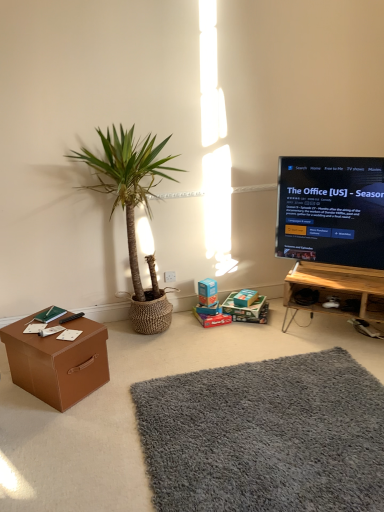
Question: Considering the relative sizes of black plastic remote control at lower left and cardboard box at center, the first cardboard box positioned from the left, in the image provided, is black plastic remote control at lower left thinner than cardboard box at center, the first cardboard box positioned from the left,?

Choices:
 (A) no
 (B) yes

Answer: (B)

Question: From the image's perspective, does black plastic remote control at lower left appear lower than cardboard box at center, acting as the second cardboard box starting from the right?

Choices:
 (A) no
 (B) yes

Answer: (A)

Question: Can you confirm if black plastic remote control at lower left is smaller than cardboard box at center, acting as the second cardboard box starting from the right?

Choices:
 (A) no
 (B) yes

Answer: (B)

Question: Can you confirm if black plastic remote control at lower left is taller than cardboard box at center, acting as the second cardboard box starting from the right?

Choices:
 (A) yes
 (B) no

Answer: (B)

Question: Considering the relative sizes of black plastic remote control at lower left and cardboard box at center, acting as the second cardboard box starting from the right, in the image provided, is black plastic remote control at lower left wider than cardboard box at center, acting as the second cardboard box starting from the right,?

Choices:
 (A) no
 (B) yes

Answer: (A)

Question: Is black plastic remote control at lower left oriented away from cardboard box at center, the first cardboard box positioned from the left?

Choices:
 (A) no
 (B) yes

Answer: (A)

Question: Does cardboard box at center, acting as the second cardboard box starting from the right, lie behind black glossy tv at right?

Choices:
 (A) yes
 (B) no

Answer: (A)

Question: Can you confirm if cardboard box at center, the first cardboard box positioned from the left, is thinner than black glossy tv at right?

Choices:
 (A) yes
 (B) no

Answer: (B)

Question: Is black glossy tv at right located within cardboard box at center, acting as the second cardboard box starting from the right?

Choices:
 (A) no
 (B) yes

Answer: (A)

Question: Would you say cardboard box at center, the first cardboard box positioned from the left, is outside black glossy tv at right?

Choices:
 (A) no
 (B) yes

Answer: (B)

Question: Considering the relative sizes of cardboard box at center, acting as the second cardboard box starting from the right, and black glossy tv at right in the image provided, is cardboard box at center, acting as the second cardboard box starting from the right, bigger than black glossy tv at right?

Choices:
 (A) yes
 (B) no

Answer: (B)

Question: From the image's perspective, is cardboard box at center, acting as the second cardboard box starting from the right, under black glossy tv at right?

Choices:
 (A) no
 (B) yes

Answer: (B)

Question: Is gray shaggy rug at lower center oriented towards cardboard box at center, which is counted as the first cardboard box, starting from the right?

Choices:
 (A) no
 (B) yes

Answer: (A)